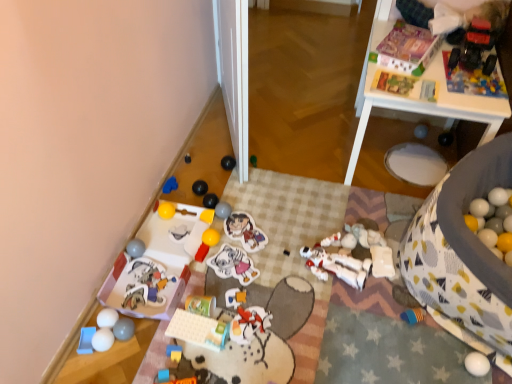
The height and width of the screenshot is (384, 512). I want to click on vacant space that's between white matte sticker at center, which is the nineteenth toy from left to right, and white matte plush at center, which ranks as the fourth toy in right-to-left order, so click(x=284, y=270).